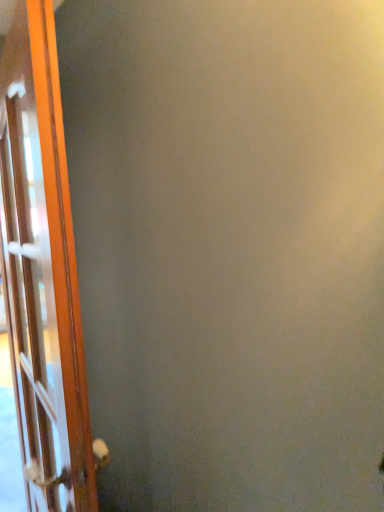
Question: Should I look upward or downward to see wooden door at left?

Choices:
 (A) down
 (B) up

Answer: (A)